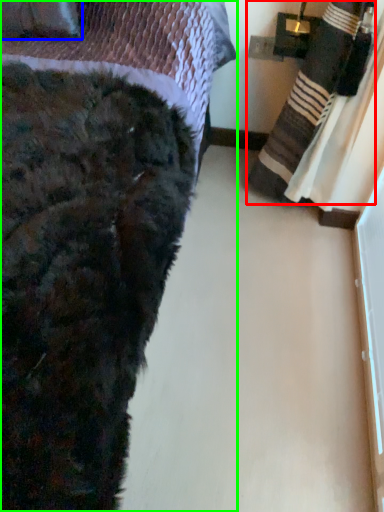
Question: Estimate the real-world distances between objects in this image. Which object is farther from blanket (highlighted by a red box), throw pillow (highlighted by a blue box) or bed (highlighted by a green box)?

Choices:
 (A) throw pillow
 (B) bed

Answer: (A)